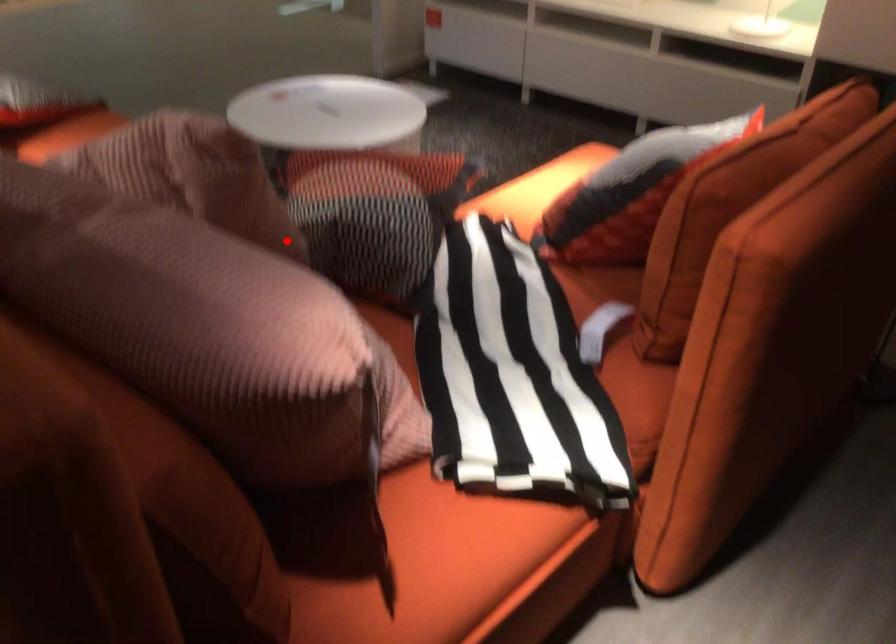
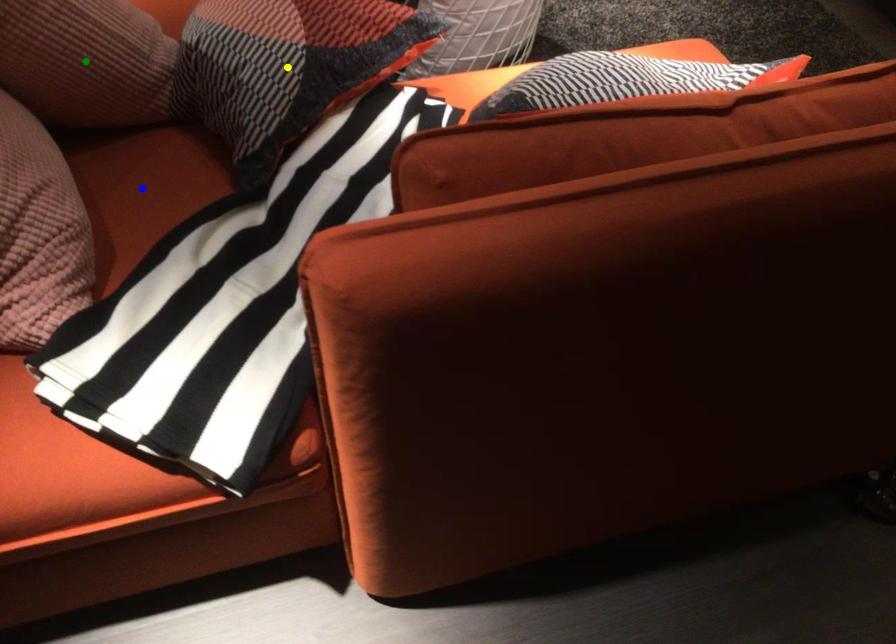
Question: I am providing you with two images of the same scene from different viewpoints. A red point is marked on the first image. You are given multiple points on the second image. Can you choose the point in image 2 that corresponds to the point in image 1?

Choices:
 (A) yellow point
 (B) green point
 (C) blue point

Answer: (B)